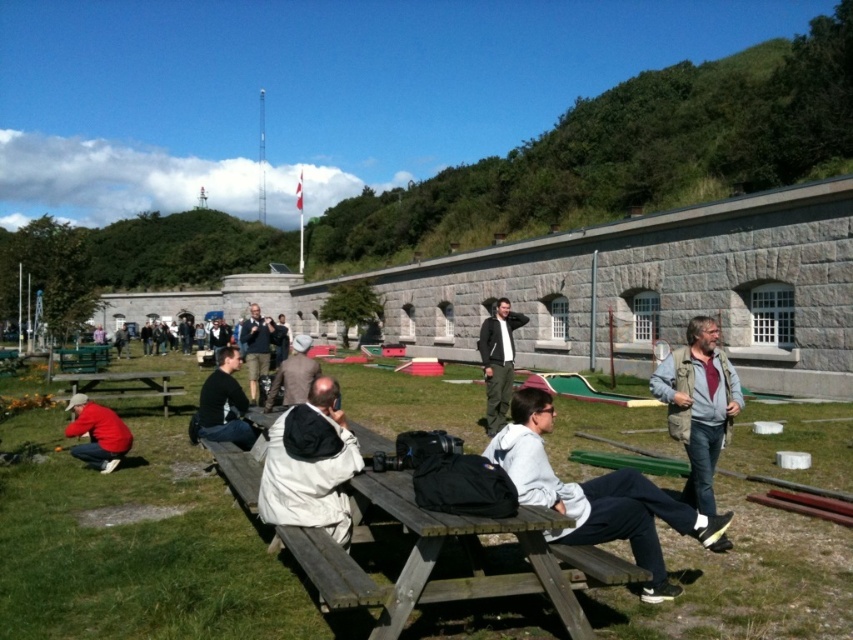
You are standing at the center of the picnic area and want to find the beige fabric jacket at center. According to the coordinates given, in which direction should you look to locate it?

The beige fabric jacket at center is located at coordinates approximately 0.728 on the x and 0.365 on the y axis. Since you are at the center, which is typically considered as the origin point, the jacket is to the northeast direction from your position.

You are a photographer trying to capture a shot of the light gray hoodie at center and the wooden picnic table at lower left. Can you tell me which object is positioned higher in the image?

The light gray hoodie at center is above the wooden picnic table at lower left, so it is positioned higher in the image.

You are standing at the picnic area and want to borrow a jacket from either the beige fabric jacket at center or the dark blue jacket at center. If you can only reach items within 10 meters, which jacket can you borrow?

Both the beige fabric jacket at center and the dark blue jacket at center are within your reach since the distance between them is 9.05 meters, which is less than 10 meters.